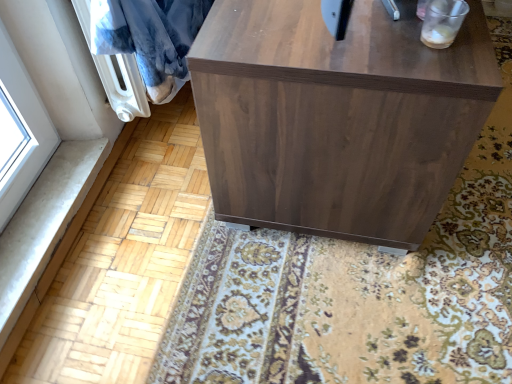
Question: Is walnut wood cabinet at center located outside blue plush blanket at upper left?

Choices:
 (A) no
 (B) yes

Answer: (B)

Question: From a real-world perspective, is walnut wood cabinet at center on blue plush blanket at upper left?

Choices:
 (A) yes
 (B) no

Answer: (B)

Question: Is walnut wood cabinet at center facing towards blue plush blanket at upper left?

Choices:
 (A) no
 (B) yes

Answer: (B)

Question: Is walnut wood cabinet at center wider than blue plush blanket at upper left?

Choices:
 (A) no
 (B) yes

Answer: (B)

Question: Is walnut wood cabinet at center looking in the opposite direction of blue plush blanket at upper left?

Choices:
 (A) yes
 (B) no

Answer: (A)

Question: Is walnut wood cabinet at center thinner than blue plush blanket at upper left?

Choices:
 (A) yes
 (B) no

Answer: (B)

Question: Can you confirm if blue plush blanket at upper left is shorter than walnut wood cabinet at center?

Choices:
 (A) no
 (B) yes

Answer: (B)

Question: Can you confirm if blue plush blanket at upper left is thinner than walnut wood cabinet at center?

Choices:
 (A) yes
 (B) no

Answer: (A)

Question: From a real-world perspective, is blue plush blanket at upper left on walnut wood cabinet at center?

Choices:
 (A) no
 (B) yes

Answer: (B)

Question: Is the position of blue plush blanket at upper left less distant than that of walnut wood cabinet at center?

Choices:
 (A) yes
 (B) no

Answer: (B)

Question: Would you say blue plush blanket at upper left is outside walnut wood cabinet at center?

Choices:
 (A) yes
 (B) no

Answer: (A)

Question: From the image's perspective, is blue plush blanket at upper left below walnut wood cabinet at center?

Choices:
 (A) no
 (B) yes

Answer: (B)

Question: Looking at the image, does walnut wood cabinet at center seem bigger or smaller compared to blue plush blanket at upper left?

Choices:
 (A) small
 (B) big

Answer: (B)